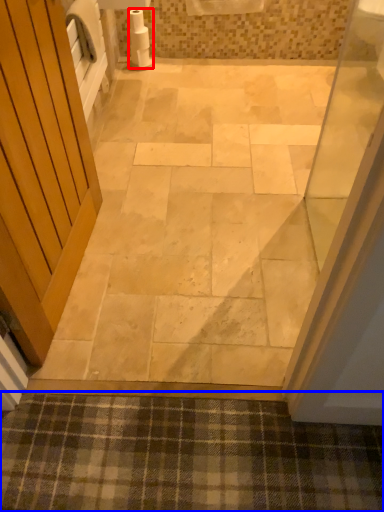
Question: Which of the following is the closest to the observer, toilet paper (highlighted by a red box) or bath mat (highlighted by a blue box)?

Choices:
 (A) toilet paper
 (B) bath mat

Answer: (B)